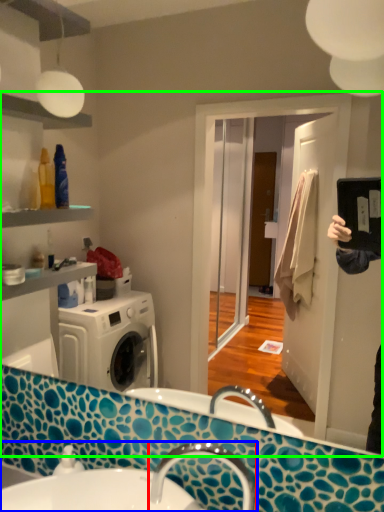
Question: Considering the real-world distances, which object is farthest from tap (highlighted by a red box)? sink (highlighted by a blue box) or mirror (highlighted by a green box)?

Choices:
 (A) sink
 (B) mirror

Answer: (B)